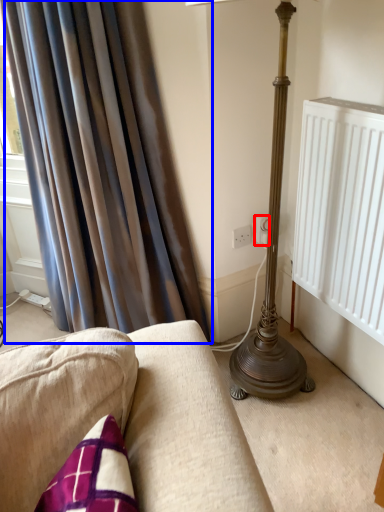
Question: Which object appears farthest to the camera in this image, electric outlet (highlighted by a red box) or curtain (highlighted by a blue box)?

Choices:
 (A) electric outlet
 (B) curtain

Answer: (A)